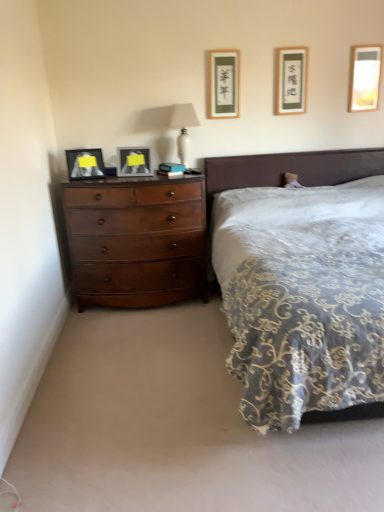
Where is `matte glass picture frame at left, the second picture frame in the left-to-right sequence`? matte glass picture frame at left, the second picture frame in the left-to-right sequence is located at coordinates click(133, 161).

Measure the distance between matte black picture frame at left, which ranks as the fifth picture frame in right-to-left order, and camera.

They are 3.29 meters apart.

Find the location of `matte gold picture frame at upper center, which is the third picture frame from right to left`. matte gold picture frame at upper center, which is the third picture frame from right to left is located at coordinates (224, 83).

What do you see at coordinates (288, 169) in the screenshot? This screenshot has width=384, height=512. I see `velvet-like brown bed at center` at bounding box center [288, 169].

Identify the location of matte glass picture frame at left, the second picture frame in the left-to-right sequence. (133, 161).

Is point (375, 65) farther from viewer compared to point (276, 90)?

No, it is in front of (276, 90).

How much distance is there between matte glass picture frame at upper right, arranged as the fifth picture frame when viewed from the left, and matte black picture frame at upper center, the 4th picture frame positioned from the left?

matte glass picture frame at upper right, arranged as the fifth picture frame when viewed from the left, and matte black picture frame at upper center, the 4th picture frame positioned from the left, are 20.39 inches apart.

Which of these two, matte glass picture frame at upper right, positioned as the first picture frame in right-to-left order, or matte black picture frame at upper center, the 4th picture frame positioned from the left, is wider?

matte black picture frame at upper center, the 4th picture frame positioned from the left.

From the image's perspective, would you say matte glass picture frame at upper right, positioned as the first picture frame in right-to-left order, is shown under matte black picture frame at upper center, the 2th picture frame in the right-to-left sequence?

No, from the image's perspective, matte glass picture frame at upper right, positioned as the first picture frame in right-to-left order, is not below matte black picture frame at upper center, the 2th picture frame in the right-to-left sequence.

Between matte black picture frame at left, which is the first picture frame from left to right, and matte black picture frame at upper center, the 4th picture frame positioned from the left, which one has smaller size?

With smaller size is matte black picture frame at upper center, the 4th picture frame positioned from the left.

From the image's perspective, is matte black picture frame at left, which ranks as the fifth picture frame in right-to-left order, located beneath matte black picture frame at upper center, the 2th picture frame in the right-to-left sequence?

Yes, from the image's perspective, matte black picture frame at left, which ranks as the fifth picture frame in right-to-left order, is below matte black picture frame at upper center, the 2th picture frame in the right-to-left sequence.

In the scene shown: Would you say matte black picture frame at left, which ranks as the fifth picture frame in right-to-left order, is to the left or to the right of matte black picture frame at upper center, the 4th picture frame positioned from the left, in the picture?

matte black picture frame at left, which ranks as the fifth picture frame in right-to-left order, is positioned on matte black picture frame at upper center, the 4th picture frame positioned from the left,'s left side.

Is matte black picture frame at left, which is the first picture frame from left to right, not within matte black picture frame at upper center, the 4th picture frame positioned from the left?

Indeed, matte black picture frame at left, which is the first picture frame from left to right, is completely outside matte black picture frame at upper center, the 4th picture frame positioned from the left.

Is velvet-like brown bed at center oriented away from matte black picture frame at upper center, the 2th picture frame in the right-to-left sequence?

No, matte black picture frame at upper center, the 2th picture frame in the right-to-left sequence, is not at the back of velvet-like brown bed at center.

How different are the orientations of velvet-like brown bed at center and matte black picture frame at upper center, the 2th picture frame in the right-to-left sequence, in degrees?

The angular difference between velvet-like brown bed at center and matte black picture frame at upper center, the 2th picture frame in the right-to-left sequence, is 0.0084 degrees.

From a real-world perspective, is velvet-like brown bed at center physically located above or below matte black picture frame at upper center, the 2th picture frame in the right-to-left sequence?

From a real-world perspective, velvet-like brown bed at center is physically below matte black picture frame at upper center, the 2th picture frame in the right-to-left sequence.

This screenshot has height=512, width=384. Identify the location of the 4th picture frame located above the velvet-like brown bed at center (from a real-world perspective). (291, 80).

Does matte glass picture frame at upper right, positioned as the first picture frame in right-to-left order, have a lesser width compared to white glossy lamp at upper center?

Yes, matte glass picture frame at upper right, positioned as the first picture frame in right-to-left order, is thinner than white glossy lamp at upper center.

From the white glossy lamp at upper center, count 3rd picture frame to the right and point to it. Please provide its 2D coordinates.

[(364, 78)]

From a real-world perspective, between matte glass picture frame at upper right, positioned as the first picture frame in right-to-left order, and white glossy lamp at upper center, who is vertically higher?

From a 3D spatial view, matte glass picture frame at upper right, positioned as the first picture frame in right-to-left order, is above.

Could matte glass picture frame at left, positioned as the fourth picture frame in right-to-left order, be considered to be inside white glossy lamp at upper center?

That's incorrect, matte glass picture frame at left, positioned as the fourth picture frame in right-to-left order, is not inside white glossy lamp at upper center.

Which point is more distant from viewer, (186, 154) or (144, 172)?

The point (186, 154) is farther.

In terms of width, does white glossy lamp at upper center look wider or thinner when compared to matte glass picture frame at left, positioned as the fourth picture frame in right-to-left order?

Clearly, white glossy lamp at upper center has more width compared to matte glass picture frame at left, positioned as the fourth picture frame in right-to-left order.

How many degrees apart are the facing directions of matte glass picture frame at upper right, positioned as the first picture frame in right-to-left order, and matte black picture frame at left, which is the first picture frame from left to right?

matte glass picture frame at upper right, positioned as the first picture frame in right-to-left order, and matte black picture frame at left, which is the first picture frame from left to right, are facing 16 degrees away from each other.

From a real-world perspective, is matte glass picture frame at upper right, arranged as the fifth picture frame when viewed from the left, over matte black picture frame at left, which ranks as the fifth picture frame in right-to-left order?

Indeed, from a real-world perspective, matte glass picture frame at upper right, arranged as the fifth picture frame when viewed from the left, stands above matte black picture frame at left, which ranks as the fifth picture frame in right-to-left order.

From the image's perspective, is matte glass picture frame at upper right, positioned as the first picture frame in right-to-left order, above or below matte black picture frame at left, which ranks as the fifth picture frame in right-to-left order?

Based on their image positions, matte glass picture frame at upper right, positioned as the first picture frame in right-to-left order, is located above matte black picture frame at left, which ranks as the fifth picture frame in right-to-left order.

Looking at this image, are matte glass picture frame at upper right, arranged as the fifth picture frame when viewed from the left, and matte black picture frame at left, which ranks as the fifth picture frame in right-to-left order, located far from each other?

Yes, matte glass picture frame at upper right, arranged as the fifth picture frame when viewed from the left, and matte black picture frame at left, which ranks as the fifth picture frame in right-to-left order, are located far from each other.

Is matte gold picture frame at upper center, which is the third picture frame from right to left, facing away from matte black picture frame at upper center, the 4th picture frame positioned from the left?

No, matte gold picture frame at upper center, which is the third picture frame from right to left, is not facing the opposite direction of matte black picture frame at upper center, the 4th picture frame positioned from the left.

The width and height of the screenshot is (384, 512). What are the coordinates of `picture frame that is the 1st one when counting leftward from the matte black picture frame at upper center, the 2th picture frame in the right-to-left sequence` in the screenshot? It's located at (224, 83).

Could you measure the distance between matte gold picture frame at upper center, the 3th picture frame viewed from the left, and matte black picture frame at upper center, the 2th picture frame in the right-to-left sequence?

matte gold picture frame at upper center, the 3th picture frame viewed from the left, and matte black picture frame at upper center, the 2th picture frame in the right-to-left sequence, are 46.18 centimeters apart from each other.

Does matte gold picture frame at upper center, which is the third picture frame from right to left, appear on the right side of matte black picture frame at upper center, the 4th picture frame positioned from the left?

In fact, matte gold picture frame at upper center, which is the third picture frame from right to left, is to the left of matte black picture frame at upper center, the 4th picture frame positioned from the left.

The width and height of the screenshot is (384, 512). In order to click on the 1st picture frame in front of the matte glass picture frame at upper right, positioned as the first picture frame in right-to-left order in this screenshot , I will do `click(291, 80)`.

From a real-world perspective, starting from the matte black picture frame at left, which is the first picture frame from left to right, which picture frame is the 3rd one vertically above it? Please provide its 2D coordinates.

[(291, 80)]

When comparing their distances from matte gold picture frame at upper center, the 3th picture frame viewed from the left, does velvet-like brown bed at center or shiny brown dresser at left seem closer?

Among the two, velvet-like brown bed at center is located nearer to matte gold picture frame at upper center, the 3th picture frame viewed from the left.

Estimate the real-world distances between objects in this image. Which object is closer to matte gold picture frame at upper center, which is the third picture frame from right to left, matte black picture frame at left, which ranks as the fifth picture frame in right-to-left order, or velvet-like brown bed at center?

velvet-like brown bed at center.

Looking at the image, which one is located further to matte glass picture frame at upper right, positioned as the first picture frame in right-to-left order, matte gold picture frame at upper center, the 3th picture frame viewed from the left, or shiny brown dresser at left?

shiny brown dresser at left is positioned further to the anchor matte glass picture frame at upper right, positioned as the first picture frame in right-to-left order.

Based on their spatial positions, is white glossy lamp at upper center or matte gold picture frame at upper center, the 3th picture frame viewed from the left, closer to shiny brown dresser at left?

white glossy lamp at upper center.

Estimate the real-world distances between objects in this image. Which object is further from velvet-like brown bed at center, shiny brown dresser at left or white glossy lamp at upper center?

shiny brown dresser at left lies further to velvet-like brown bed at center than the other object.

From the image, which object appears to be farther from matte gold picture frame at upper center, the 3th picture frame viewed from the left, matte black picture frame at left, which ranks as the fifth picture frame in right-to-left order, or white glossy lamp at upper center?

Based on the image, matte black picture frame at left, which ranks as the fifth picture frame in right-to-left order, appears to be further to matte gold picture frame at upper center, the 3th picture frame viewed from the left.

Considering their positions, is velvet-like brown bed at center positioned closer to matte gold picture frame at upper center, the 3th picture frame viewed from the left, than matte glass picture frame at left, positioned as the fourth picture frame in right-to-left order?

Based on the image, velvet-like brown bed at center appears to be nearer to matte gold picture frame at upper center, the 3th picture frame viewed from the left.

Estimate the real-world distances between objects in this image. Which object is further from matte black picture frame at left, which is the first picture frame from left to right, velvet-like brown bed at center or shiny brown dresser at left?

The object further to matte black picture frame at left, which is the first picture frame from left to right, is velvet-like brown bed at center.

Where is `chest of drawers between matte glass picture frame at left, the second picture frame in the left-to-right sequence, and matte glass picture frame at upper right, arranged as the fifth picture frame when viewed from the left, in the horizontal direction`? chest of drawers between matte glass picture frame at left, the second picture frame in the left-to-right sequence, and matte glass picture frame at upper right, arranged as the fifth picture frame when viewed from the left, in the horizontal direction is located at coordinates (137, 241).

The image size is (384, 512). Identify the location of bedside lamp between matte black picture frame at left, which ranks as the fifth picture frame in right-to-left order, and matte gold picture frame at upper center, the 3th picture frame viewed from the left. (183, 128).

The image size is (384, 512). In order to click on bed between matte black picture frame at left, which ranks as the fifth picture frame in right-to-left order, and matte glass picture frame at upper right, positioned as the first picture frame in right-to-left order, from left to right in this screenshot , I will do `click(288, 169)`.

Locate an element on the screen. This screenshot has width=384, height=512. picture frame between matte gold picture frame at upper center, which is the third picture frame from right to left, and matte glass picture frame at upper right, arranged as the fifth picture frame when viewed from the left is located at coordinates (291, 80).